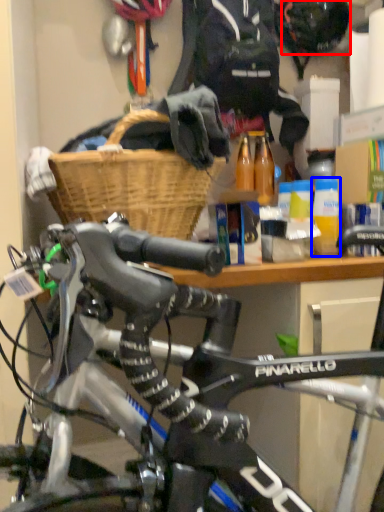
Question: Which object appears farthest to the camera in this image, bicycle helmet (highlighted by a red box) or bottle (highlighted by a blue box)?

Choices:
 (A) bicycle helmet
 (B) bottle

Answer: (A)